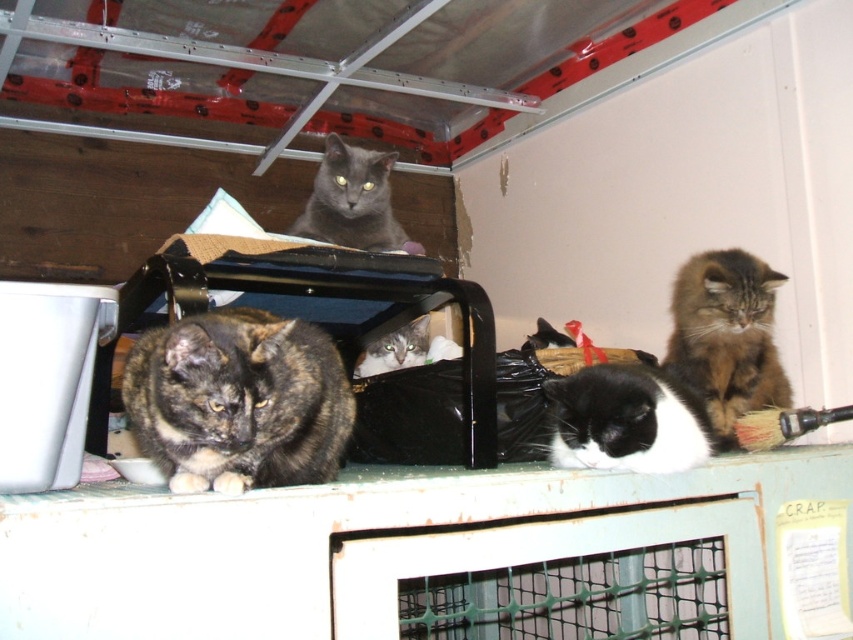
Question: Does shiny gray cat at upper center have a greater width compared to gray fur cat at center?

Choices:
 (A) yes
 (B) no

Answer: (A)

Question: Does white plastic ledge at center appear under metallic silver exhaust hood at upper center?

Choices:
 (A) yes
 (B) no

Answer: (A)

Question: Which object is closer to the camera taking this photo?

Choices:
 (A) black and white fur cat at center
 (B) tabby fur cat at upper right
 (C) gray fur cat at center

Answer: (A)

Question: Among these objects, which one is farthest from the camera?

Choices:
 (A) gray fur cat at center
 (B) black and white fur cat at center
 (C) white plastic ledge at center
 (D) tabby fur cat at upper right

Answer: (A)

Question: Considering the real-world distances, which object is closest to the shiny gray cat at upper center?

Choices:
 (A) white plastic ledge at center
 (B) gray fur cat at center
 (C) metallic silver exhaust hood at upper center
 (D) tabby fur cat at upper right

Answer: (B)

Question: Can you confirm if metallic silver exhaust hood at upper center is smaller than shiny gray cat at upper center?

Choices:
 (A) yes
 (B) no

Answer: (B)